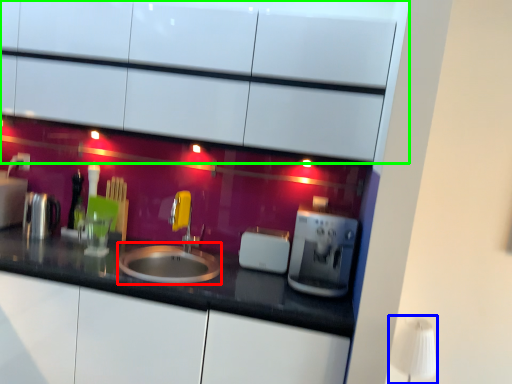
Question: Which object is the farthest from sink (highlighted by a red box)? Choose among these: table lamp (highlighted by a blue box) or cabinetry (highlighted by a green box).

Choices:
 (A) table lamp
 (B) cabinetry

Answer: (A)